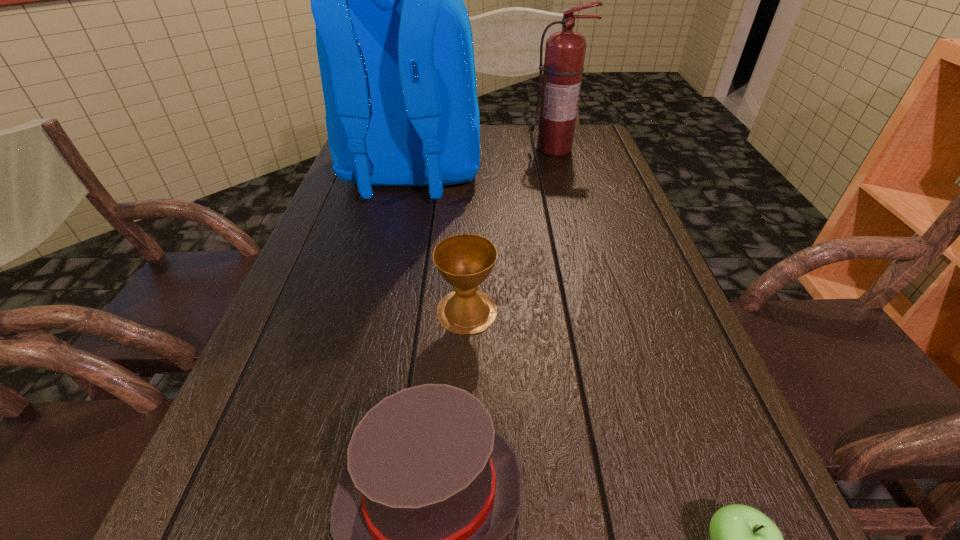
The width and height of the screenshot is (960, 540). Identify the location of the tallest object. (395, 48).

Where is `fire extinguisher`? This screenshot has height=540, width=960. fire extinguisher is located at coordinates (563, 67).

Identify the location of the third nearest object. (465, 261).

You are a GUI agent. You are given a task and a screenshot of the screen. Output one action in this format:
    pyautogui.click(x=<x>, y=<y>)
    Task: Click on the free location located 0.160m on the back of the backpack
    The width and height of the screenshot is (960, 540).
    Given the screenshot: What is the action you would take?
    pyautogui.click(x=392, y=261)

Where is `free space located on the front-facing side of the fire extinguisher`? Image resolution: width=960 pixels, height=540 pixels. free space located on the front-facing side of the fire extinguisher is located at coordinates (563, 176).

The image size is (960, 540). In order to click on free spot located 0.120m on the left of the chalice in this screenshot , I will do `click(374, 311)`.

The width and height of the screenshot is (960, 540). I want to click on backpack that is at the far edge, so click(395, 48).

Where is `fire extinguisher positioned at the far edge`? The width and height of the screenshot is (960, 540). fire extinguisher positioned at the far edge is located at coordinates (563, 67).

Where is `object situated at the left edge`? object situated at the left edge is located at coordinates (395, 48).

Locate an element on the screen. The height and width of the screenshot is (540, 960). object present at the right edge is located at coordinates (563, 67).